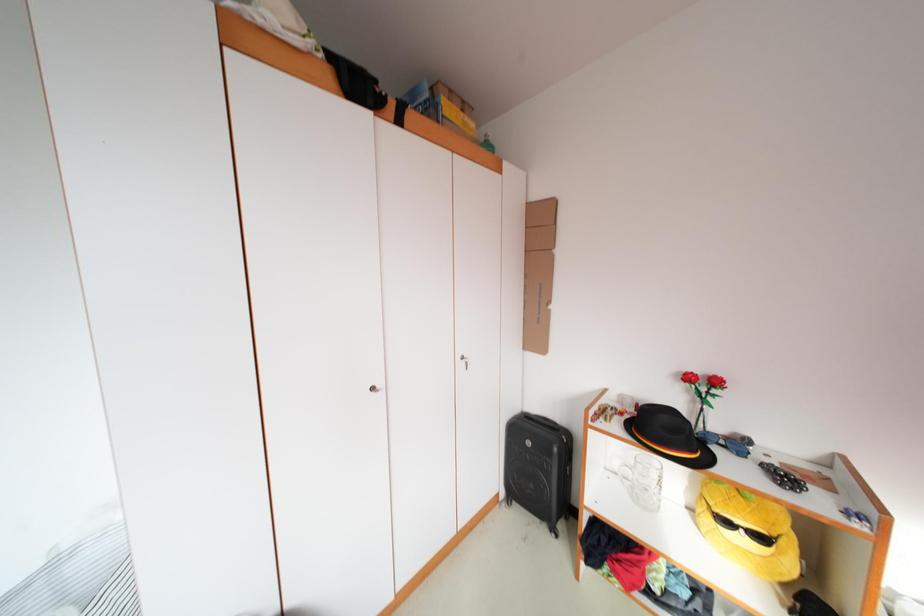
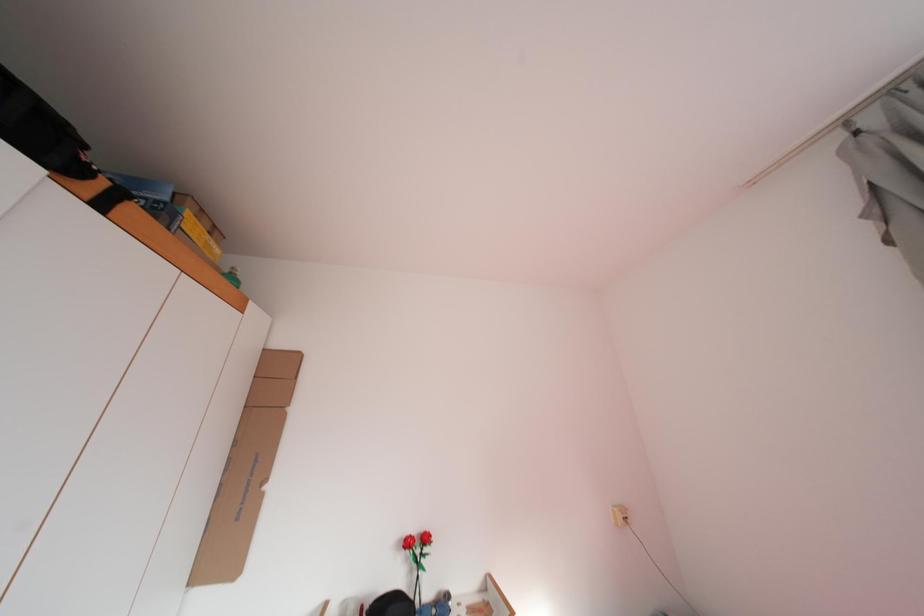
First-person continuous shooting, in which direction is the camera rotating?

The rotation direction of the camera is right-up.